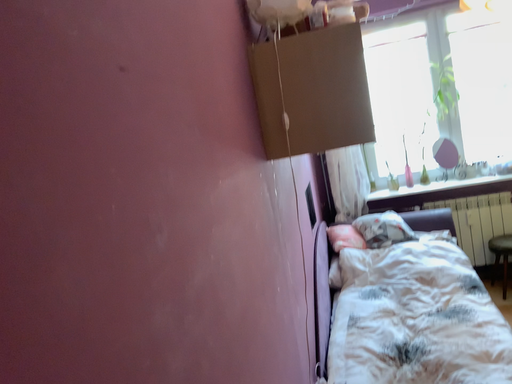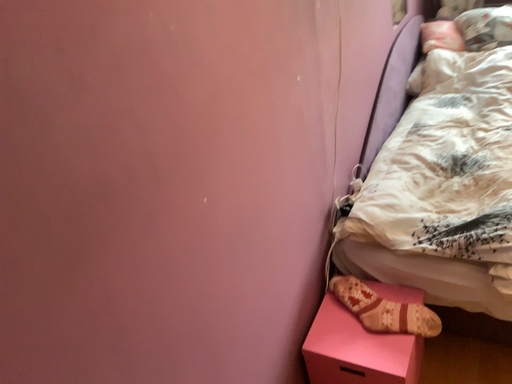
Question: Which way did the camera rotate in the video?

Choices:
 (A) rotated downward
 (B) rotated upward

Answer: (A)